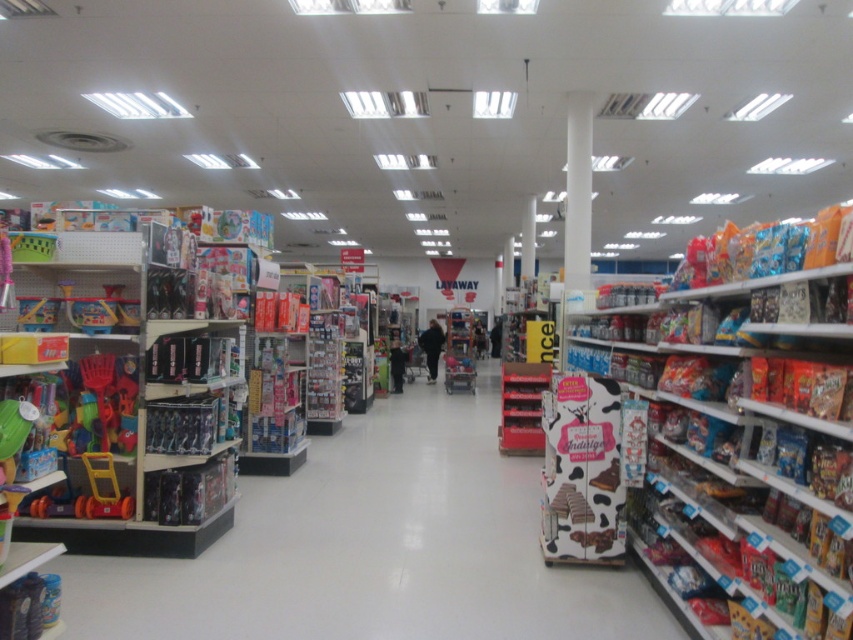
You are a customer in the store and want to place both the plastic toys at left and the matte cardboard box at right onto a shelf that can only hold items up to the size of the larger object. Which object should you use as the size reference?

The plastic toys at left is larger in size than the matte cardboard box at right, so you should use the plastic toys at left as the size reference to ensure the shelf can accommodate both items.

You are a delivery person who just arrived at the store and need to place a new item in the storage area. The storage area has a height limit of 1 meter. The item you are carrying is 1.2 meters tall. You see the matte cardboard box at right and the white smooth pillar at center. Which object can you use to determine if your item will fit in the storage area?

The matte cardboard box at right is larger in size than the white smooth pillar at center. Since the item is 1.2 meters tall and the storage area has a height limit of 1 meter, neither object can determine the item will fit because the item exceeds the height limit.

You are a customer in the store and need to retrieve an item located behind the plastic toys at left and the matte cardboard box at right. Which object should you move first to access the item?

You should move the plastic toys at left first because it is positioned to the left of the matte cardboard box at right, meaning it is closer to your current position and easier to access.